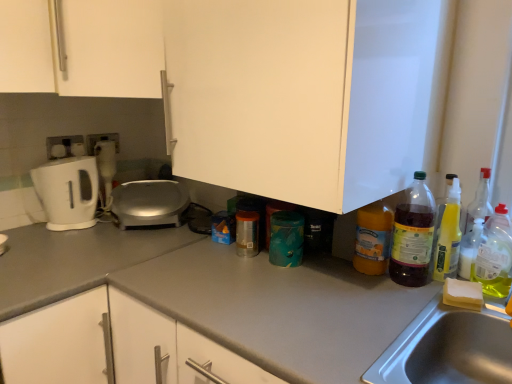
Find the location of a particular element. vacant space situated on the left part of satin silver appliance at center is located at coordinates 75,230.